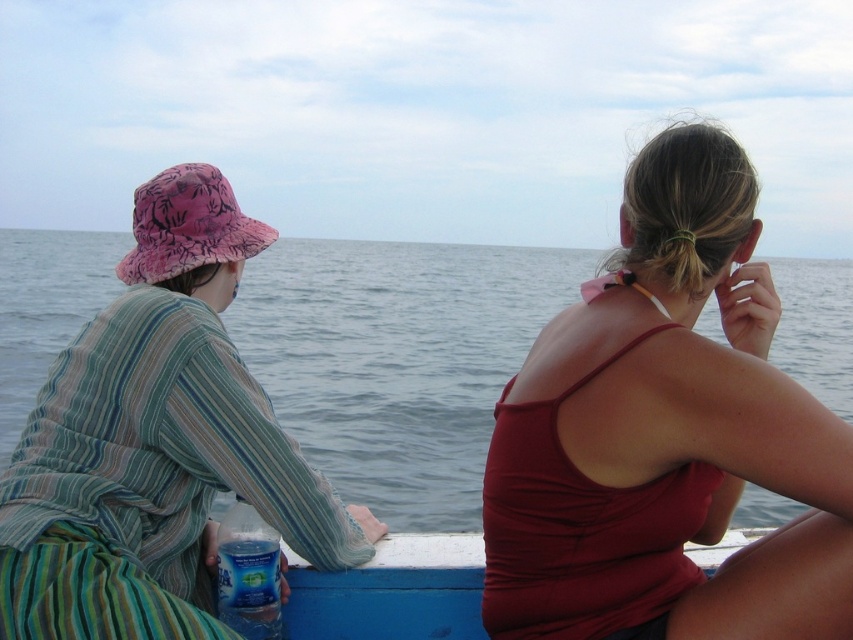
You are a photographer trying to capture the scene of the blue water at center and the blue painted wood boat at lower center. Which object appears taller in the photo?

The blue water at center appears taller in the photo than the blue painted wood boat at lower center because it has a greater height compared to it.

You are on a boat and need to hand a life jacket to the person wearing the striped cotton shirt at left and the pink fabric hat at left. Which one is closer to your current position if you are standing behind them both?

The pink fabric hat at left is closer to your current position because the striped cotton shirt at left is to the right of the pink fabric hat at left, meaning the pink fabric hat at left is positioned more to the left side and therefore closer if you are standing behind them both.